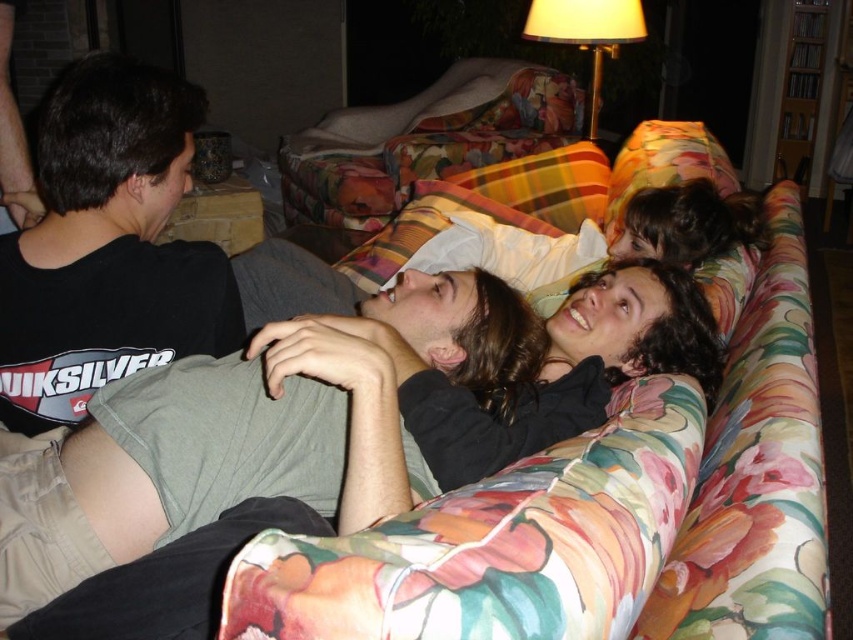
Question: Is gray cotton shirt at center behind black soft hair at center?

Choices:
 (A) yes
 (B) no

Answer: (B)

Question: Observing the image, what is the correct spatial positioning of black cotton t-shirt at left in reference to metallic gold lampshade at upper right?

Choices:
 (A) left
 (B) right

Answer: (A)

Question: Is gray cotton shirt at center thinner than metallic gold lampshade at upper right?

Choices:
 (A) yes
 (B) no

Answer: (B)

Question: Which point is farther from the camera taking this photo?

Choices:
 (A) (390, 465)
 (B) (80, 298)
 (C) (619, 458)

Answer: (B)

Question: Among these points, which one is nearest to the camera?

Choices:
 (A) (461, 416)
 (B) (209, 394)
 (C) (573, 33)
 (D) (78, 188)

Answer: (B)

Question: Which of the following is the closest to the observer?

Choices:
 (A) floral fabric couch at center
 (B) black cotton t-shirt at left

Answer: (A)